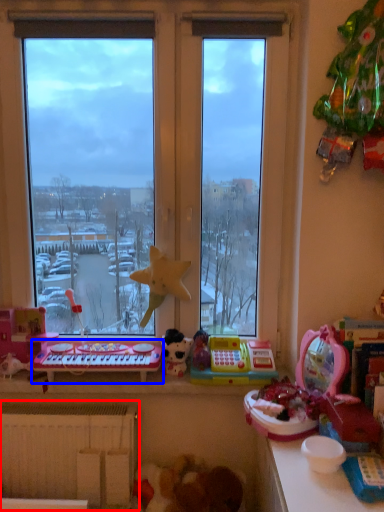
Question: Which object is closer to the camera taking this photo, radiator (highlighted by a red box) or musical keyboard (highlighted by a blue box)?

Choices:
 (A) radiator
 (B) musical keyboard

Answer: (A)